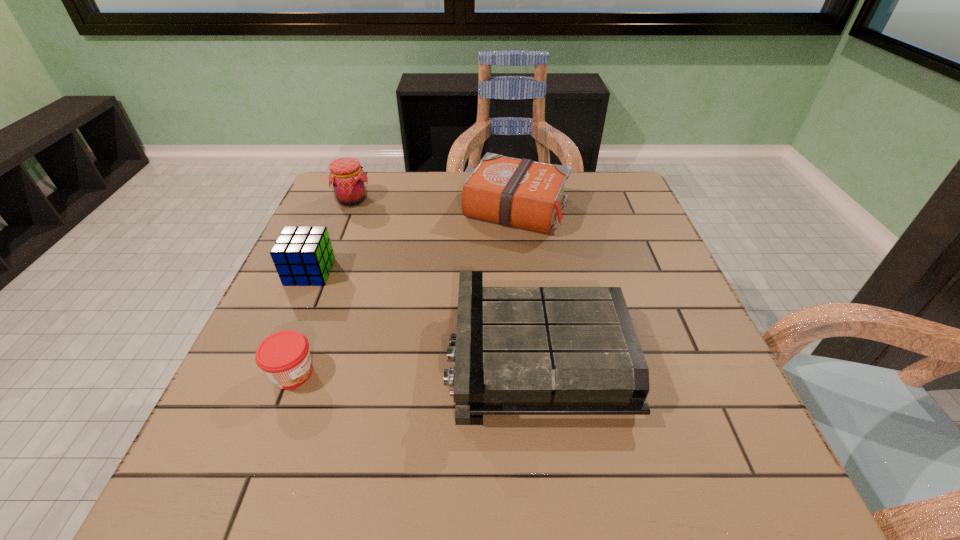
Identify the location of free region at the far right corner of the desktop. (622, 201).

You are a GUI agent. You are given a task and a screenshot of the screen. Output one action in this format:
    pyautogui.click(x=<x>, y=<y>)
    Task: Click on the vacant space in between the cube and the Bible
    The width and height of the screenshot is (960, 540).
    Given the screenshot: What is the action you would take?
    pyautogui.click(x=413, y=241)

Identify the location of unoccupied area between the Bible and the radio receiver. (526, 282).

Locate an element on the screen. vacant area between the nearer jam and the cube is located at coordinates (301, 322).

Locate an element on the screen. The height and width of the screenshot is (540, 960). blank region between the cube and the radio receiver is located at coordinates (423, 314).

Locate an element on the screen. Image resolution: width=960 pixels, height=540 pixels. free space between the nearer jam and the Bible is located at coordinates (404, 291).

At what (x,y) coordinates should I click in order to perform the action: click on vacant area between the taller jam and the Bible. Please return your answer as a coordinate pair (x, y). This screenshot has height=540, width=960. Looking at the image, I should click on (434, 205).

Find the location of a particular element. empty location between the Bible and the third nearest object is located at coordinates (413, 241).

The width and height of the screenshot is (960, 540). Identify the location of free space between the shortest object and the cube. (301, 322).

Locate an element on the screen. vacant space that is in between the Bible and the shorter jam is located at coordinates (404, 291).